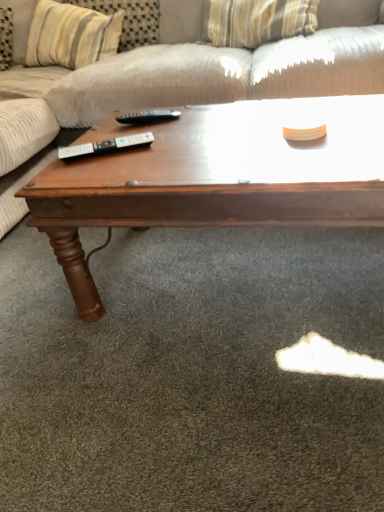
Locate an element on the screen. empty space that is to the right of black plastic remote at center, marked as the 2th remote in a bottom-to-top arrangement is located at coordinates (211, 117).